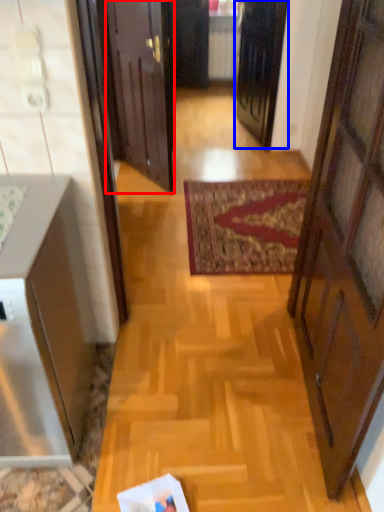
Question: Which point is further to the camera, door (highlighted by a red box) or door (highlighted by a blue box)?

Choices:
 (A) door
 (B) door

Answer: (B)